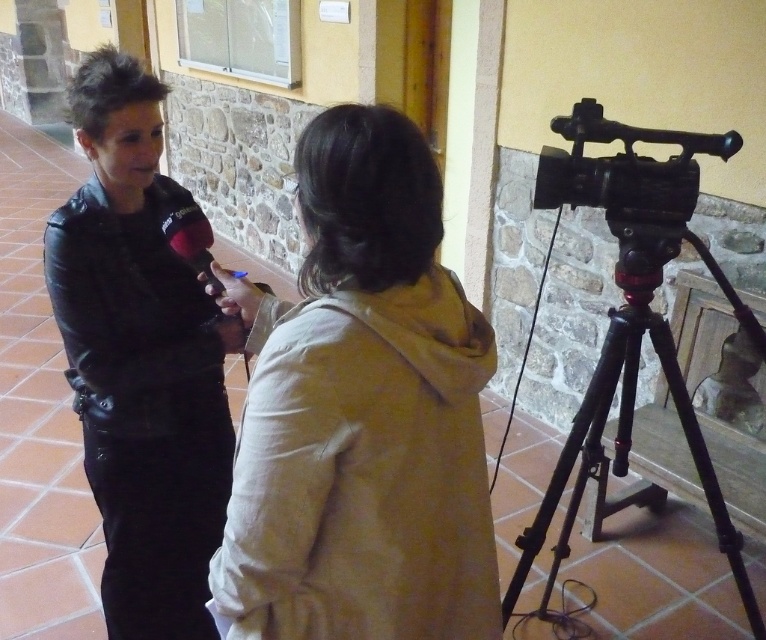
You are setting up a camera on the black metal tripod at right for a video call. To ensure the beige cotton hoodie at center is visible in the frame, should you adjust the tripod to move it closer or further away from the hoodie?

The beige cotton hoodie at center is in front of the black metal tripod at right, so the tripod is behind the hoodie. To include both in the frame, move the tripod closer to the hoodie so it can be positioned behind it without blocking the view.

You are setting up a camera on the black metal tripod at right for a video call. The matte black jacket at left is blocking your view. Can you move the tripod to the right to get a better angle without moving the jacket?

The matte black jacket at left is to the left of the black metal tripod at right. Moving the tripod further to the right would increase the distance between them, which might help avoid the jacket blocking the view.

You are an interior designer observing the indoor interview setting. You need to place a small decorative item at the point with coordinates point (141,358). What object will be directly under this point?

The point (141,358) indicates the matte black jacket at left, so the small decorative item will be placed directly under the matte black jacket at left.